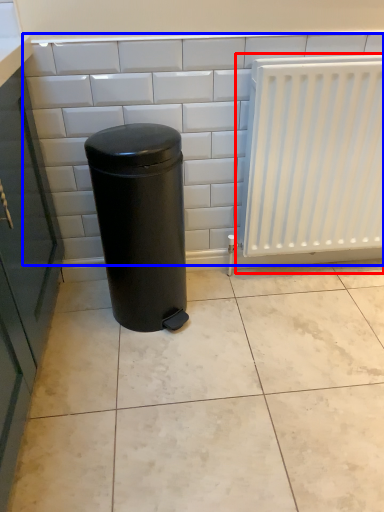
Question: Among these objects, which one is farthest to the camera, radiator (highlighted by a red box) or ceramic tile (highlighted by a blue box)?

Choices:
 (A) radiator
 (B) ceramic tile

Answer: (B)